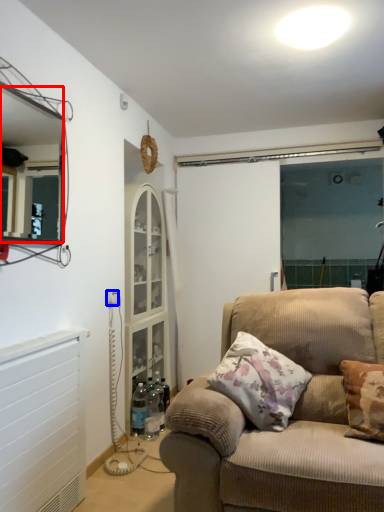
Question: Which object appears farthest to the camera in this image, mirror (highlighted by a red box) or electric outlet (highlighted by a blue box)?

Choices:
 (A) mirror
 (B) electric outlet

Answer: (B)